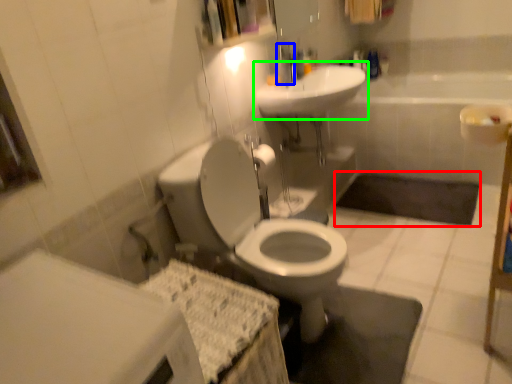
Question: Considering the real-world distances, which object is farthest from bath mat (highlighted by a red box)? faucet (highlighted by a blue box) or sink (highlighted by a green box)?

Choices:
 (A) faucet
 (B) sink

Answer: (A)